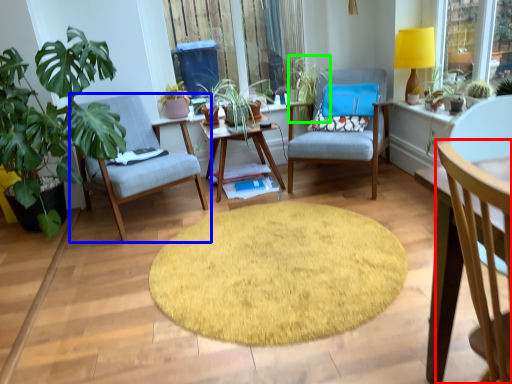
Question: Estimate the real-world distances between objects in this image. Which object is farther from chair (highlighted by a red box), chair (highlighted by a blue box) or vegetation (highlighted by a green box)?

Choices:
 (A) chair
 (B) vegetation

Answer: (B)